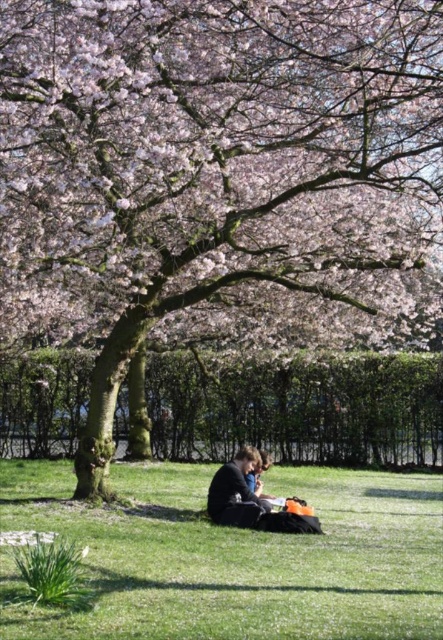
You are a gardener who wants to place a 6 feet long wooden bench between the green grass at center and the matte black jacket at center. Is there enough space for the bench?

The distance between the green grass at center and the matte black jacket at center is 5.84 feet, which is slightly shorter than the 6 feet required for the bench. Therefore, the bench would not fit in the available space.

You are standing in the scene and want to place a small potted plant on the ground. You see the green grass at center and the matte black jacket at center. Which surface would be more appropriate for placing the potted plant?

The green grass at center is below the matte black jacket at center, so placing the potted plant on the green grass at center would be more appropriate as it is a natural surface for plants.

You are standing in the middle of the scene and want to know if the matte black jacket at center is taller than the green grass at center. Can you determine this based on the scene?

The green grass at center has a lesser height compared to matte black jacket at center, so yes, the matte black jacket at center is taller than the green grass at center.